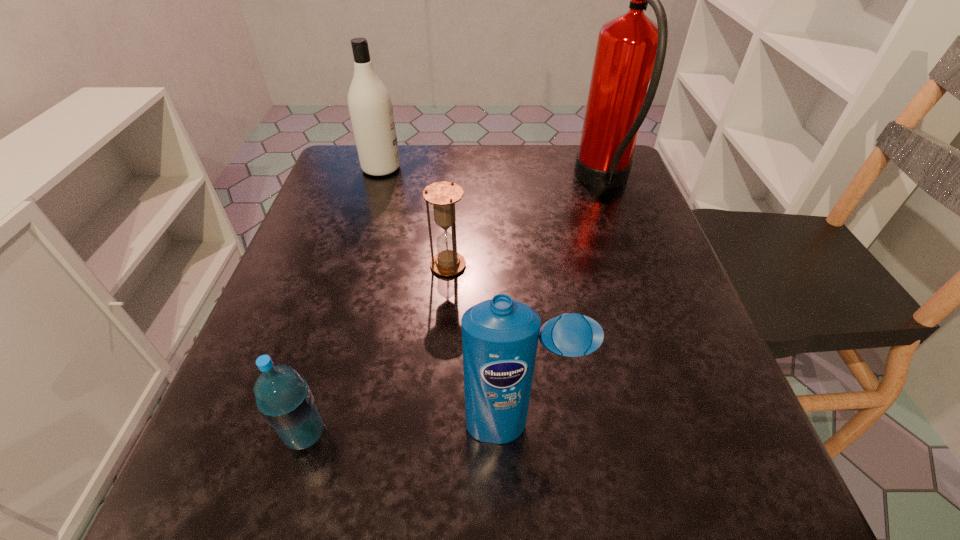
Image resolution: width=960 pixels, height=540 pixels. I want to click on vacant point located between the right shampoo and the water bottle, so click(x=413, y=430).

Find the location of `vacant point located between the hourglass and the farther shampoo`. vacant point located between the hourglass and the farther shampoo is located at coordinates (415, 217).

Locate an element on the screen. This screenshot has height=540, width=960. free space between the nearer shampoo and the water bottle is located at coordinates (413, 430).

Where is `free space that is in between the third object from right to left and the farther shampoo`? The height and width of the screenshot is (540, 960). free space that is in between the third object from right to left and the farther shampoo is located at coordinates (415, 217).

Find the location of a particular element. empty space between the water bottle and the third object from right to left is located at coordinates (376, 350).

This screenshot has height=540, width=960. In order to click on free space between the third object from right to left and the fire extinguisher in this screenshot , I will do `click(526, 224)`.

Select which object is the third closest to the rightmost object. Please provide its 2D coordinates. Your answer should be formatted as a tuple, i.e. [(x, y)], where the tuple contains the x and y coordinates of a point satisfying the conditions above.

[(500, 336)]

Find the location of `object that is the third closest to the water bottle`. object that is the third closest to the water bottle is located at coordinates (370, 106).

This screenshot has width=960, height=540. I want to click on blank space that satisfies the following two spatial constraints: 1. on the front-facing side of the farther shampoo; 2. on the right side of the water bottle, so click(302, 434).

This screenshot has width=960, height=540. In order to click on vacant area that satisfies the following two spatial constraints: 1. on the front-facing side of the tallest object; 2. on the right side of the farther shampoo in this screenshot , I will do `click(377, 181)`.